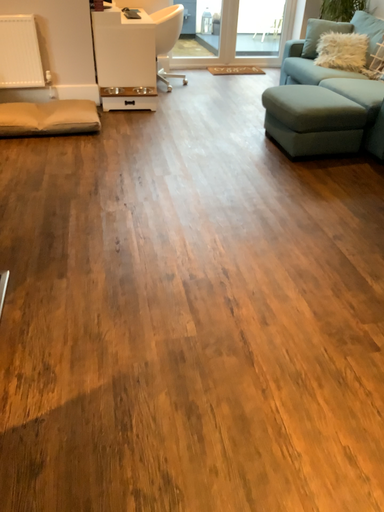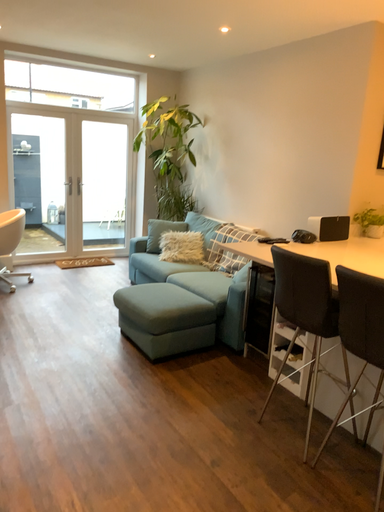
Question: Which way did the camera rotate in the video?

Choices:
 (A) rotated upward
 (B) rotated downward

Answer: (A)